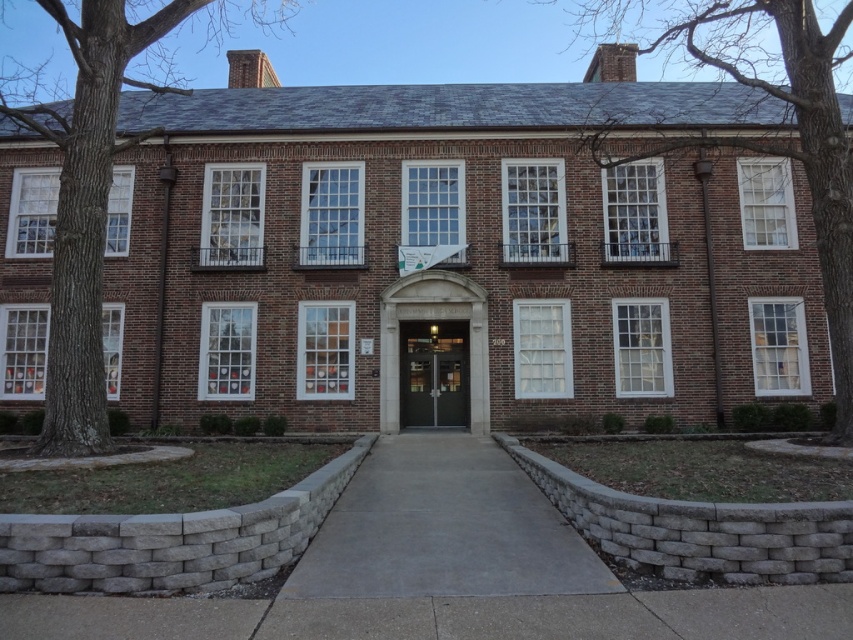
Question: Which point is closer to the camera?

Choices:
 (A) gray concrete pavement at center
 (B) matte gray door at center

Answer: (A)

Question: Is gray concrete pavement at center to the left of matte gray door at center from the viewer's perspective?

Choices:
 (A) yes
 (B) no

Answer: (B)

Question: Which point is farther to the camera?

Choices:
 (A) matte gray door at center
 (B) gray concrete pavement at center

Answer: (A)

Question: Is gray concrete pavement at center in front of matte gray door at center?

Choices:
 (A) no
 (B) yes

Answer: (B)

Question: Where is gray concrete pavement at center located in relation to matte gray door at center in the image?

Choices:
 (A) left
 (B) right

Answer: (B)

Question: Which point is farther to the camera?

Choices:
 (A) matte gray door at center
 (B) gray concrete pavement at center

Answer: (A)